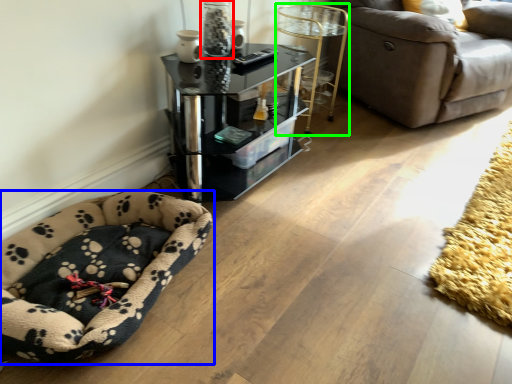
Question: Estimate the real-world distances between objects in this image. Which object is farther from glass vase (highlighted by a red box), dog bed (highlighted by a blue box) or side table (highlighted by a green box)?

Choices:
 (A) dog bed
 (B) side table

Answer: (A)